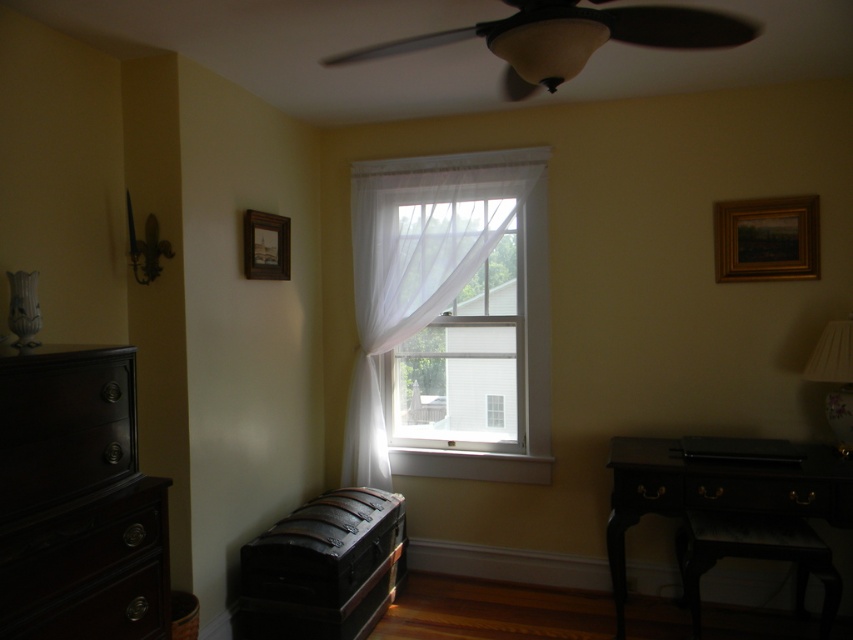
Question: Observing the image, what is the correct spatial positioning of gold metallic picture frame at upper right in reference to matte black drawer at right?

Choices:
 (A) right
 (B) left

Answer: (A)

Question: Can you confirm if sheer white curtain at center is bigger than matte black drawer at right?

Choices:
 (A) yes
 (B) no

Answer: (A)

Question: Estimate the real-world distances between objects in this image. Which object is closer to the dark wood stool at lower right?

Choices:
 (A) dark wood dresser at left
 (B) white fabric lampshade at right
 (C) sheer white curtain at center

Answer: (B)

Question: Which object appears farthest from the camera in this image?

Choices:
 (A) matte black fan at upper center
 (B) black wood drawer at lower right
 (C) wooden picture frame at upper left

Answer: (C)

Question: Is gold metallic picture frame at upper right below black wood drawer at lower right?

Choices:
 (A) yes
 (B) no

Answer: (B)

Question: Among these objects, which one is farthest from the camera?

Choices:
 (A) gold metallic picture frame at upper right
 (B) sheer white curtain at center
 (C) black wood desk at lower right
 (D) white fabric lampshade at right

Answer: (B)